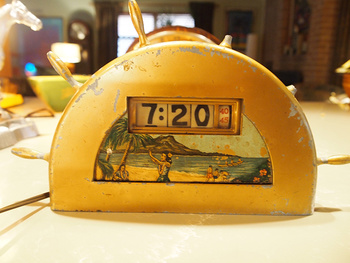
You are a GUI agent. You are given a task and a screenshot of the screen. Output one action in this format:
    pyautogui.click(x=<x>, y=<y>)
    Task: Click on the brown curtain
    The height and width of the screenshot is (263, 350).
    Given the screenshot: What is the action you would take?
    pyautogui.click(x=106, y=17)